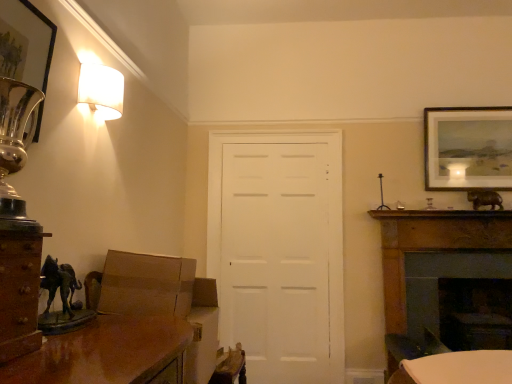
Question: Is metallic silver picture frame at upper left, acting as the 1th picture frame starting from the left, thinner than dark wood fireplace at right, acting as the 2th fireplace starting from the back?

Choices:
 (A) yes
 (B) no

Answer: (B)

Question: Is metallic silver picture frame at upper left, acting as the 1th picture frame starting from the left, bigger than dark wood fireplace at right, which is counted as the 1th fireplace, starting from the front?

Choices:
 (A) no
 (B) yes

Answer: (A)

Question: Is metallic silver picture frame at upper left, acting as the 2th picture frame starting from the right, at the right side of dark wood fireplace at right, which is counted as the 1th fireplace, starting from the front?

Choices:
 (A) yes
 (B) no

Answer: (B)

Question: From the image's perspective, is metallic silver picture frame at upper left, acting as the 2th picture frame starting from the right, under dark wood fireplace at right, which is counted as the 1th fireplace, starting from the front?

Choices:
 (A) yes
 (B) no

Answer: (B)

Question: From a real-world perspective, is metallic silver picture frame at upper left, acting as the 2th picture frame starting from the right, under dark wood fireplace at right, which is counted as the 1th fireplace, starting from the front?

Choices:
 (A) yes
 (B) no

Answer: (B)

Question: Is metallic silver picture frame at upper left, placed as the first picture frame when sorted from front to back, taller than dark wood fireplace at right, which is counted as the 1th fireplace, starting from the front?

Choices:
 (A) yes
 (B) no

Answer: (B)

Question: Would you say white matte door at center is part of matte gold picture frame at upper right, the second picture frame from the left,'s contents?

Choices:
 (A) yes
 (B) no

Answer: (B)

Question: Does matte gold picture frame at upper right, the second picture frame from the left, have a greater height compared to white matte door at center?

Choices:
 (A) yes
 (B) no

Answer: (B)

Question: Is matte gold picture frame at upper right, the first picture frame from the right, bigger than white matte door at center?

Choices:
 (A) no
 (B) yes

Answer: (A)

Question: Can you confirm if matte gold picture frame at upper right, the first picture frame viewed from the back, is positioned to the right of white matte door at center?

Choices:
 (A) yes
 (B) no

Answer: (A)

Question: From the image's perspective, would you say matte gold picture frame at upper right, the first picture frame viewed from the back, is positioned over white matte door at center?

Choices:
 (A) no
 (B) yes

Answer: (B)

Question: Is matte gold picture frame at upper right, the second picture frame from the left, oriented towards white matte door at center?

Choices:
 (A) yes
 (B) no

Answer: (B)

Question: Does white matte door at center appear on the left side of brown wood cabinet at left?

Choices:
 (A) no
 (B) yes

Answer: (A)